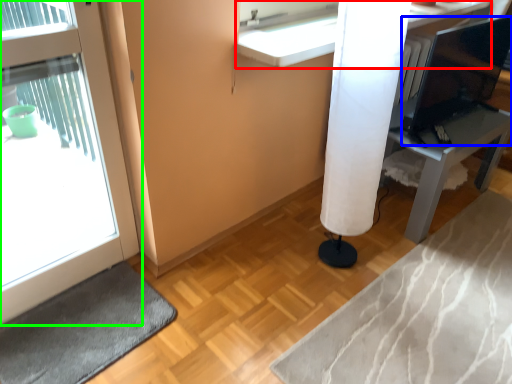
Question: Estimate the real-world distances between objects in this image. Which object is closer to counter (highlighted by a red box), computer monitor (highlighted by a blue box) or door (highlighted by a green box)?

Choices:
 (A) computer monitor
 (B) door

Answer: (B)